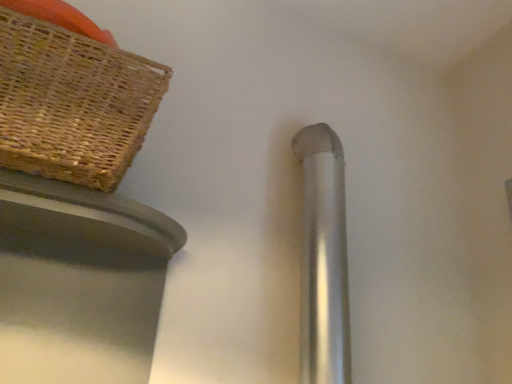
Describe the element at coordinates (72, 103) in the screenshot. I see `woven brown picnic basket at upper left` at that location.

Where is `woven brown picnic basket at upper left`? This screenshot has width=512, height=384. woven brown picnic basket at upper left is located at coordinates (72, 103).

Where is `silver metallic door handle at center`? This screenshot has width=512, height=384. silver metallic door handle at center is located at coordinates click(324, 259).

Image resolution: width=512 pixels, height=384 pixels. What do you see at coordinates (324, 259) in the screenshot?
I see `silver metallic door handle at center` at bounding box center [324, 259].

The image size is (512, 384). Find the location of `woven brown picnic basket at upper left`. woven brown picnic basket at upper left is located at coordinates (72, 103).

Is woven brown picnic basket at upper left to the left or to the right of silver metallic door handle at center in the image?

woven brown picnic basket at upper left is positioned on silver metallic door handle at center's left side.

Is the depth of woven brown picnic basket at upper left greater than that of silver metallic door handle at center?

No, it is not.

Does point (51, 41) appear closer or farther from the camera than point (323, 356)?

Clearly, point (51, 41) is closer to the camera than point (323, 356).

From the image's perspective, is woven brown picnic basket at upper left beneath silver metallic door handle at center?

Actually, woven brown picnic basket at upper left appears above silver metallic door handle at center in the image.

From a real-world perspective, is woven brown picnic basket at upper left physically above silver metallic door handle at center?

Correct, in the physical world, woven brown picnic basket at upper left is higher than silver metallic door handle at center.

Considering the relative sizes of woven brown picnic basket at upper left and silver metallic door handle at center in the image provided, is woven brown picnic basket at upper left wider than silver metallic door handle at center?

Correct, the width of woven brown picnic basket at upper left exceeds that of silver metallic door handle at center.

Consider the image. Can you confirm if woven brown picnic basket at upper left is shorter than silver metallic door handle at center?

Yes.

Between woven brown picnic basket at upper left and silver metallic door handle at center, which one has larger size?

Bigger between the two is woven brown picnic basket at upper left.

Is woven brown picnic basket at upper left outside of silver metallic door handle at center?

Absolutely, woven brown picnic basket at upper left is external to silver metallic door handle at center.

Are woven brown picnic basket at upper left and silver metallic door handle at center making contact?

No, woven brown picnic basket at upper left is not in contact with silver metallic door handle at center.

Is woven brown picnic basket at upper left positioned with its back to silver metallic door handle at center?

No, silver metallic door handle at center is not at the back of woven brown picnic basket at upper left.

The height and width of the screenshot is (384, 512). What are the coordinates of `picnic basket that appears above the silver metallic door handle at center (from a real-world perspective)` in the screenshot? It's located at (72, 103).

Is silver metallic door handle at center to the left or to the right of woven brown picnic basket at upper left in the image?

Based on their positions, silver metallic door handle at center is located to the right of woven brown picnic basket at upper left.

Which is behind, silver metallic door handle at center or woven brown picnic basket at upper left?

silver metallic door handle at center is further away from the camera.

Is point (331, 322) positioned after point (46, 153)?

Yes.

From the image's perspective, is silver metallic door handle at center beneath woven brown picnic basket at upper left?

Yes, from the image's perspective, silver metallic door handle at center is below woven brown picnic basket at upper left.

From a real-world perspective, is silver metallic door handle at center located higher than woven brown picnic basket at upper left?

Incorrect, from a real-world perspective, silver metallic door handle at center is lower than woven brown picnic basket at upper left.

Can you confirm if silver metallic door handle at center is thinner than woven brown picnic basket at upper left?

Indeed, silver metallic door handle at center has a lesser width compared to woven brown picnic basket at upper left.

Considering the sizes of objects silver metallic door handle at center and woven brown picnic basket at upper left in the image provided, who is shorter, silver metallic door handle at center or woven brown picnic basket at upper left?

woven brown picnic basket at upper left is shorter.

Considering the sizes of objects silver metallic door handle at center and woven brown picnic basket at upper left in the image provided, who is bigger, silver metallic door handle at center or woven brown picnic basket at upper left?

With larger size is woven brown picnic basket at upper left.

Is silver metallic door handle at center not within woven brown picnic basket at upper left?

Yes, silver metallic door handle at center is outside of woven brown picnic basket at upper left.

Are silver metallic door handle at center and woven brown picnic basket at upper left located far from each other?

No, silver metallic door handle at center is not far away from woven brown picnic basket at upper left.

Is silver metallic door handle at center looking in the opposite direction of woven brown picnic basket at upper left?

silver metallic door handle at center is not turned away from woven brown picnic basket at upper left.

How distant is silver metallic door handle at center from woven brown picnic basket at upper left?

19.56 inches.

You are a GUI agent. You are given a task and a screenshot of the screen. Output one action in this format:
    pyautogui.click(x=<x>, y=<y>)
    Task: Click on the door handle that is behind the woven brown picnic basket at upper left
    The height and width of the screenshot is (384, 512).
    Given the screenshot: What is the action you would take?
    (324, 259)

Image resolution: width=512 pixels, height=384 pixels. I want to click on door handle that is under the woven brown picnic basket at upper left (from a real-world perspective), so click(324, 259).

Locate an element on the screen. door handle behind the woven brown picnic basket at upper left is located at coordinates (324, 259).